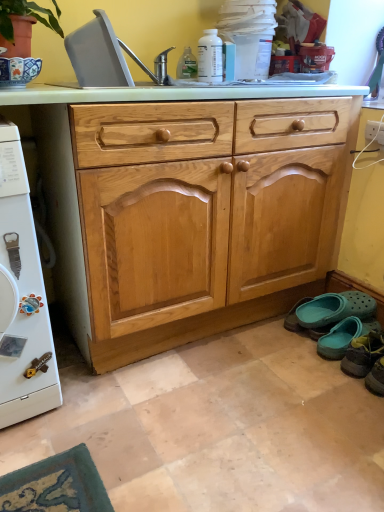
You are a GUI agent. You are given a task and a screenshot of the screen. Output one action in this format:
    pyautogui.click(x=<x>, y=<y>)
    Task: Click on the free spot above teal fabric slipper at lower right, positioned as the 2th footwear in back-to-front order (from a real-world perspective)
    This screenshot has height=512, width=384.
    Given the screenshot: What is the action you would take?
    pyautogui.click(x=372, y=335)